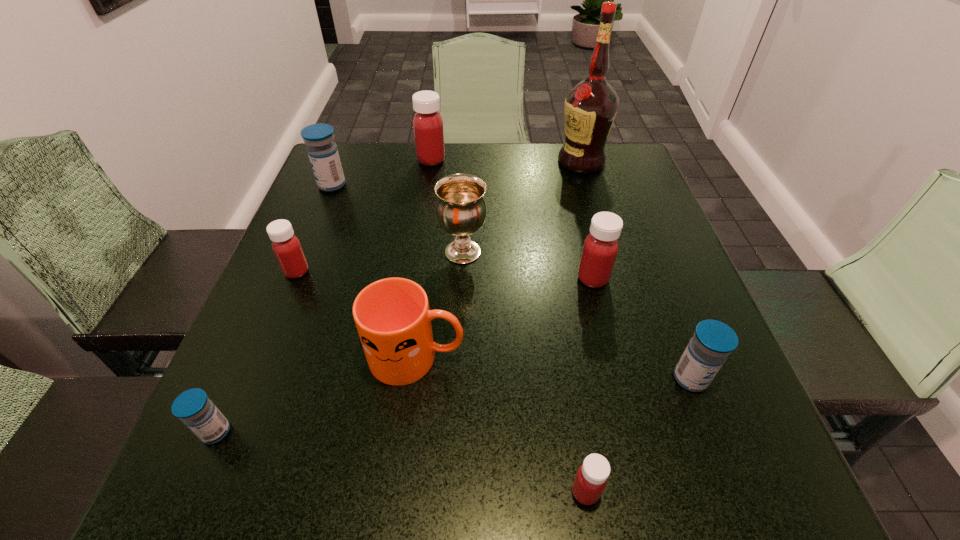
Identify the location of vacant region at the far right corner. (601, 176).

This screenshot has height=540, width=960. What are the coordinates of `free space between the leftmost red medicine and the rightmost red medicine` in the screenshot? It's located at (444, 275).

Find the location of a particular element. This screenshot has height=540, width=960. free space between the second nearest blue medicine and the fifth medicine from left to right is located at coordinates [637, 435].

This screenshot has height=540, width=960. In order to click on free space between the second nearest medicine and the farthest red medicine in this screenshot , I will do coord(324,296).

What are the coordinates of `vacant space in between the sixth farthest medicine and the sixth nearest medicine` in the screenshot? It's located at (274, 308).

In order to click on vacant space in between the third red medicine from left to right and the sixth medicine from left to right in this screenshot , I will do `click(589, 385)`.

Find the location of `vacant region between the second nearest medicine and the orange mug`. vacant region between the second nearest medicine and the orange mug is located at coordinates (317, 394).

Find the location of a particular element. vacant area that lies between the ninth farthest object and the chalice is located at coordinates (340, 342).

Where is `free spot between the fourth medicine from left to right and the orange mug`? Image resolution: width=960 pixels, height=540 pixels. free spot between the fourth medicine from left to right and the orange mug is located at coordinates (424, 259).

Find the location of a particular element. The height and width of the screenshot is (540, 960). object identified as the third closest to the mug is located at coordinates (286, 246).